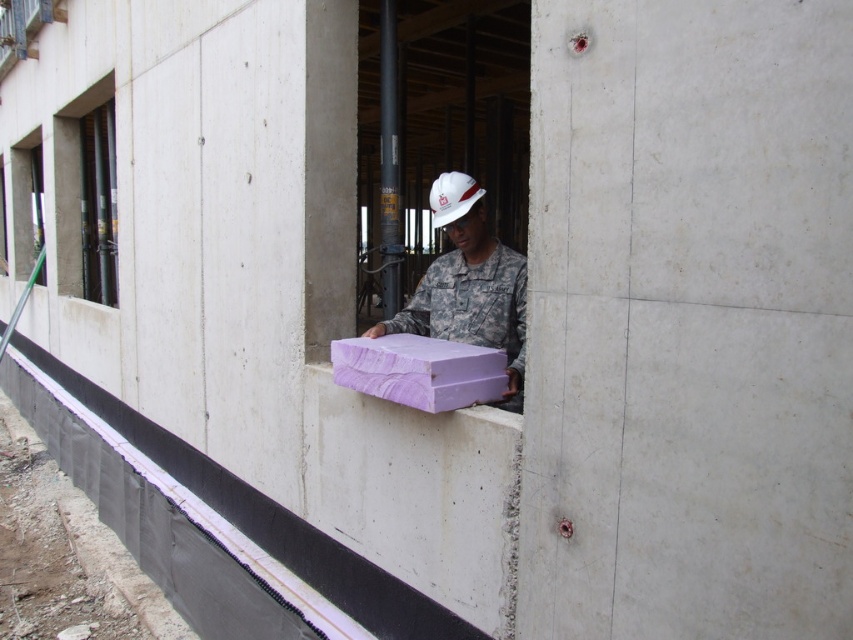
Question: Observing the image, what is the correct spatial positioning of black glass window at upper left in reference to clear glass window at upper left?

Choices:
 (A) below
 (B) above

Answer: (B)

Question: Can you confirm if purple wood at center is positioned below clear glass window at upper left?

Choices:
 (A) no
 (B) yes

Answer: (B)

Question: Among these objects, which one is nearest to the camera?

Choices:
 (A) purple matte foam at center
 (B) purple wood at center
 (C) black glass window at upper left

Answer: (B)

Question: Which point is closer to the camera?

Choices:
 (A) black glass window at upper left
 (B) purple matte foam at center
 (C) purple wood at center

Answer: (C)

Question: Can you confirm if purple wood at center is positioned above clear glass window at upper left?

Choices:
 (A) no
 (B) yes

Answer: (A)

Question: Which point is closer to the camera?

Choices:
 (A) clear glass window at upper left
 (B) purple wood at center
 (C) black glass window at upper left

Answer: (B)